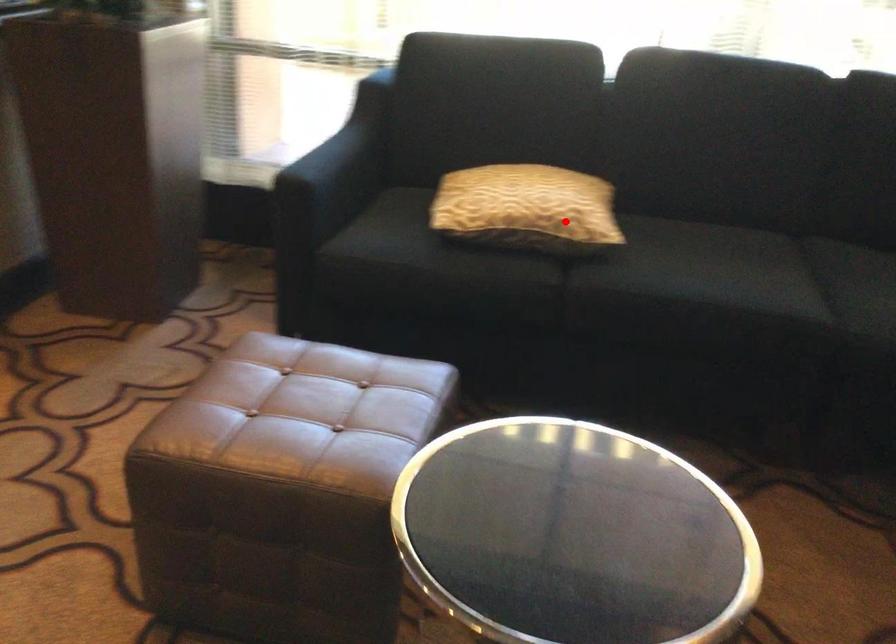
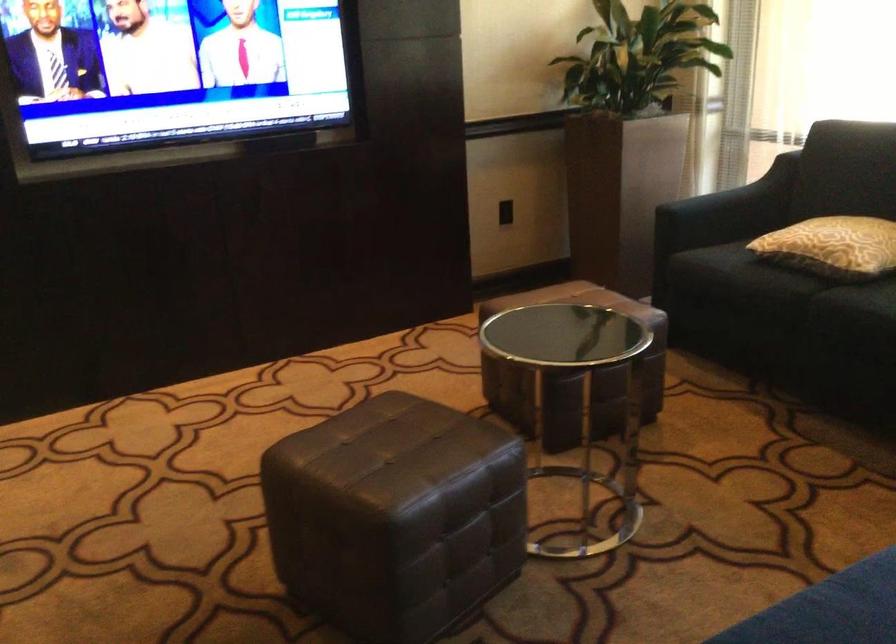
Where in the second image is the point corresponding to the highlighted location from the first image?

(832, 245)